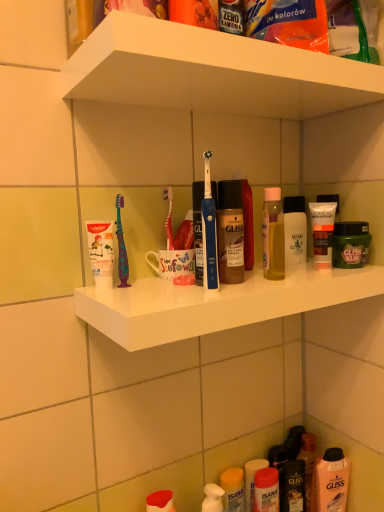
Find the location of `vacant area that is in front of white matte tube at right, which appears as the 1th toiletry when viewed from the top`. vacant area that is in front of white matte tube at right, which appears as the 1th toiletry when viewed from the top is located at coordinates (311, 279).